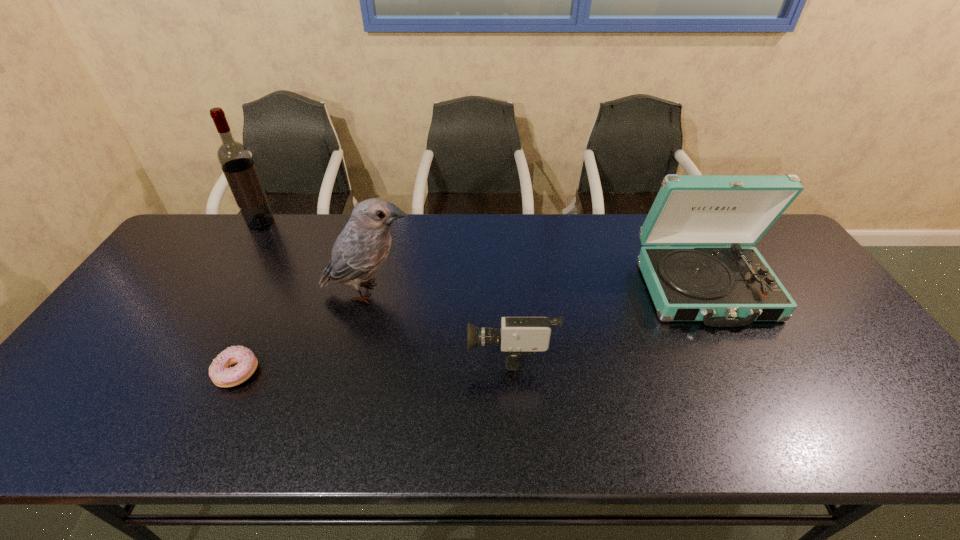
The image size is (960, 540). I want to click on vacant space located 0.270m on the front-facing side of the parrot, so click(x=511, y=292).

I want to click on free region located on the recording direction of the fourth object from left to right, so click(350, 350).

Find the location of a particular element. Image resolution: width=960 pixels, height=540 pixels. vacant space located 0.290m on the recording direction of the fourth object from left to right is located at coordinates (354, 350).

Where is `vacant area situated 0.280m on the recording direction of the fourth object from left to right`? The image size is (960, 540). vacant area situated 0.280m on the recording direction of the fourth object from left to right is located at coordinates (358, 350).

Find the location of `vacant area situated on the left of the fourth object from right to left`. vacant area situated on the left of the fourth object from right to left is located at coordinates (117, 373).

I want to click on wine bottle present at the far edge, so click(235, 159).

Where is `record player present at the far edge`? This screenshot has width=960, height=540. record player present at the far edge is located at coordinates (732, 286).

Identify the location of object at the right edge. (732, 286).

This screenshot has width=960, height=540. I want to click on object located in the far right corner section of the desktop, so click(x=732, y=286).

Locate an element on the screen. This screenshot has width=960, height=540. vacant position at the far edge of the desktop is located at coordinates (402, 228).